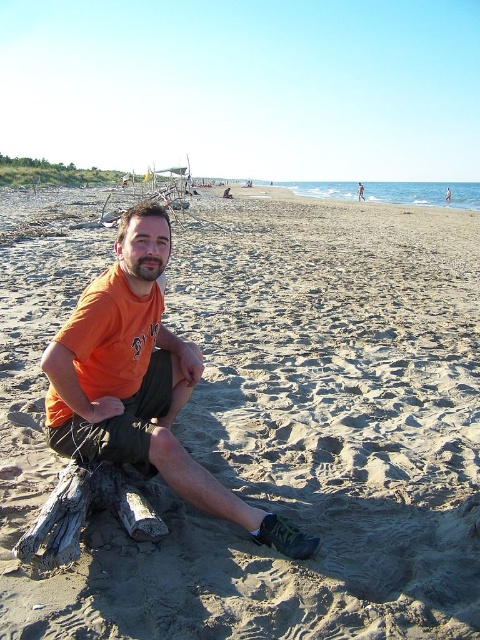
Between point (338, 580) and point (66, 508), which one is positioned in front?

Positioned in front is point (338, 580).

Does point (348, 621) lie in front of point (57, 529)?

Yes, point (348, 621) is closer to viewer.

Image resolution: width=480 pixels, height=640 pixels. What are the coordinates of `sandytexturelog at left` in the screenshot? It's located at (271, 422).

Does sandytexturelog at left come in front of orange cotton t-shirt at center?

That is True.

Who is more forward, (108, 580) or (159, 436)?

Point (108, 580) is in front.

Which is behind, point (287, 477) or point (179, 403)?

Point (179, 403)

In order to click on sandytexturelog at left in this screenshot , I will do `click(271, 422)`.

Between point (147, 451) and point (44, 536), which one is positioned behind?

Positioned behind is point (147, 451).

In the scene shown: Can you confirm if orange cotton t-shirt at center is smaller than gray weathered wood log at lower left?

Incorrect, orange cotton t-shirt at center is not smaller in size than gray weathered wood log at lower left.

Measure the distance between point (144,410) and camera.

Point (144,410) and camera are 3.23 meters apart from each other.

Where is `orange cotton t-shirt at center`? orange cotton t-shirt at center is located at coordinates (140, 381).